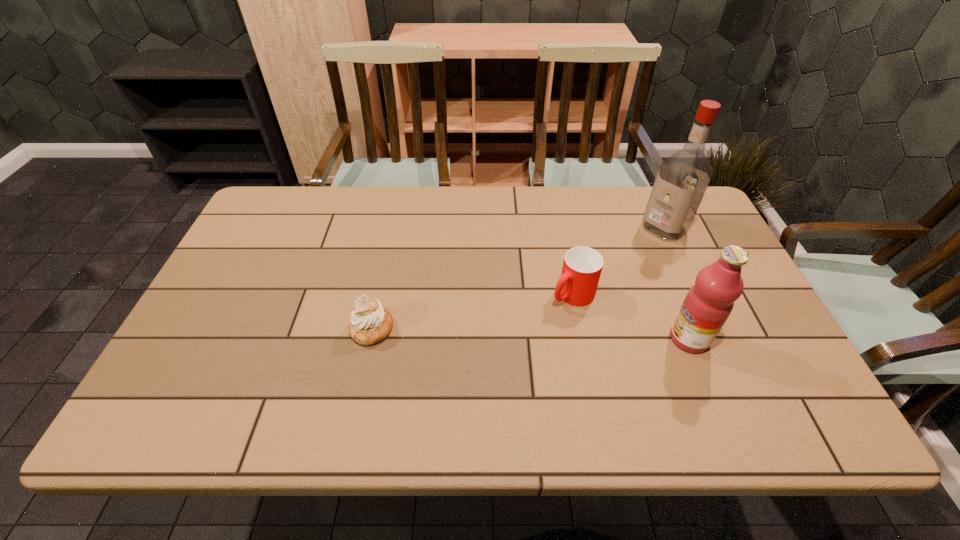
I want to click on pastry, so click(370, 323).

Find the location of a particular element. The image size is (960, 540). the shortest object is located at coordinates (370, 323).

Where is `the third shortest object`? This screenshot has height=540, width=960. the third shortest object is located at coordinates (706, 307).

At what (x,y) coordinates should I click in order to perform the action: click on liquor. Please return your answer as a coordinate pair (x, y). Looking at the image, I should click on (682, 179).

Find the location of a particular element. This screenshot has width=960, height=540. the farthest object is located at coordinates (682, 179).

Identify the location of the third tallest object. (582, 266).

Identify the location of the third nearest object. This screenshot has width=960, height=540. (582, 266).

This screenshot has width=960, height=540. In order to click on free space located 0.310m on the right of the pastry in this screenshot , I will do `click(519, 328)`.

This screenshot has height=540, width=960. Identify the location of vacant space located on the label of the fruit juice. (636, 339).

Identify the location of vacant point located on the label of the fruit juice. (545, 339).